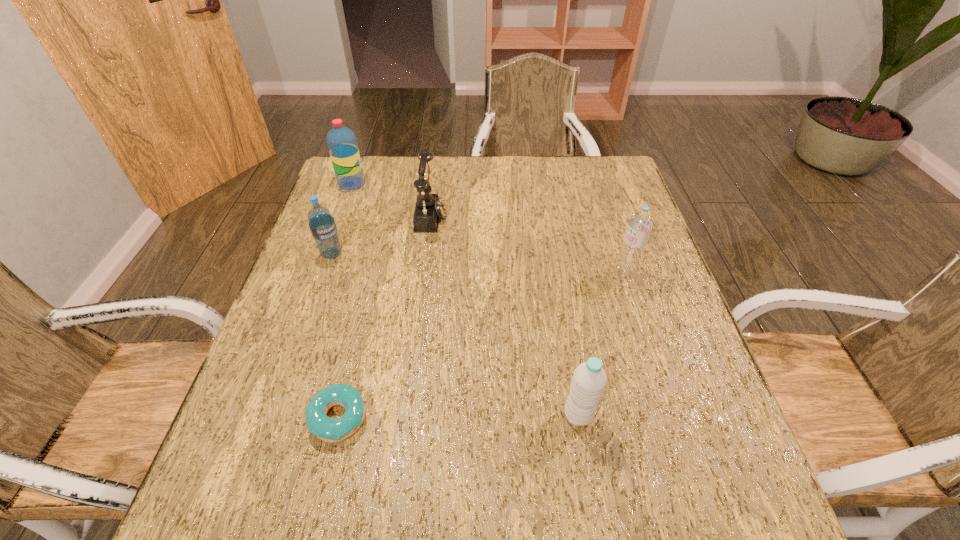
Identify the location of free spot located on the front label of the farthest water bottle. The height and width of the screenshot is (540, 960). (407, 184).

This screenshot has width=960, height=540. In order to click on free space located on the back of the third nearest object in this screenshot , I will do `click(610, 225)`.

Identify the location of vacant area located on the dial of the fourth object from left to right. (516, 214).

The width and height of the screenshot is (960, 540). Find the location of `vacant area located on the front of the second farthest water bottle`. vacant area located on the front of the second farthest water bottle is located at coordinates (288, 382).

This screenshot has width=960, height=540. Identify the location of free space located 0.380m on the left of the nearest water bottle. (365, 415).

You are a GUI agent. You are given a task and a screenshot of the screen. Output one action in this format:
    pyautogui.click(x=<x>, y=<y>)
    Task: Click on the free space located 0.250m on the back of the shortest object
    
    Given the screenshot: What is the action you would take?
    pyautogui.click(x=367, y=298)

The width and height of the screenshot is (960, 540). What are the coordinates of `water bottle present at the far edge` in the screenshot? It's located at (342, 144).

Identify the location of telephone that is positioned at the far edge. (429, 208).

You are a GUI agent. You are given a task and a screenshot of the screen. Output one action in this format:
    pyautogui.click(x=<x>, y=<y>)
    Task: Click on the doughnut positioned at the left edge
    Image resolution: width=960 pixels, height=540 pixels.
    Given the screenshot: What is the action you would take?
    pyautogui.click(x=328, y=429)

Image resolution: width=960 pixels, height=540 pixels. Identify the location of object that is positioned at the right edge. (640, 223).